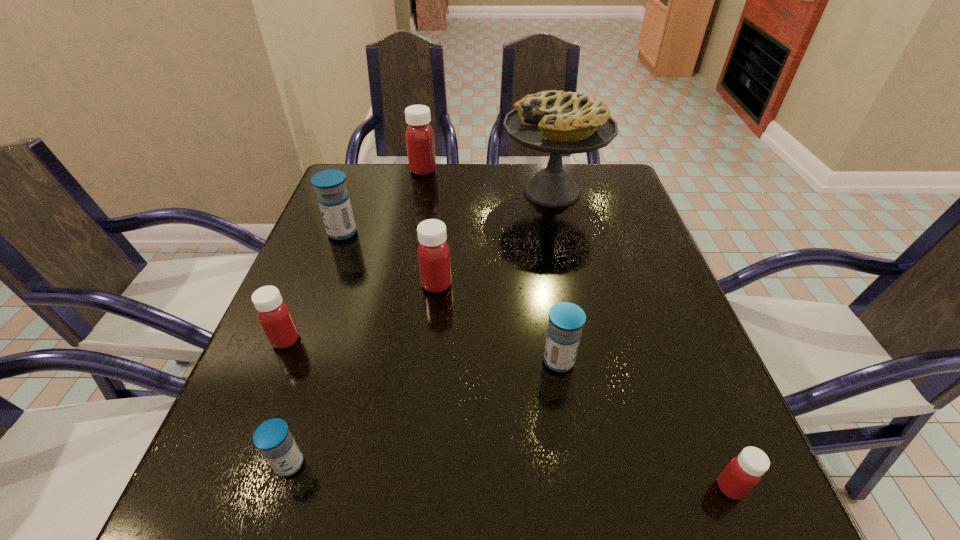
At what (x,y) coordinates should I click in order to perform the action: click on the second farthest blue medicine. Please return your answer as a coordinate pair (x, y). Image resolution: width=960 pixels, height=540 pixels. Looking at the image, I should click on (566, 320).

Locate an element on the screen. This screenshot has height=540, width=960. the smallest blue medicine is located at coordinates (272, 437).

Identify the location of the smallest red medicine. (744, 472).

Find the location of `the nearest red medicine`. the nearest red medicine is located at coordinates (744, 472).

The height and width of the screenshot is (540, 960). In order to click on vacant area situated on the cut side of the tallest object in this screenshot , I will do `click(386, 192)`.

This screenshot has height=540, width=960. What are the coordinates of `free location located on the cut side of the tallest object` in the screenshot? It's located at (445, 192).

Where is `vacant area located on the cut side of the tallest object`? vacant area located on the cut side of the tallest object is located at coordinates (442, 192).

Find the location of a particular element. The width and height of the screenshot is (960, 540). vacant area located on the left of the fourth medicine from left to right is located at coordinates (378, 170).

Identify the location of vacant area situated on the front of the third farthest object. The image size is (960, 540). [x=287, y=380].

Find the location of a particular element. vacant space located on the right of the fourth object from right to left is located at coordinates tap(551, 285).